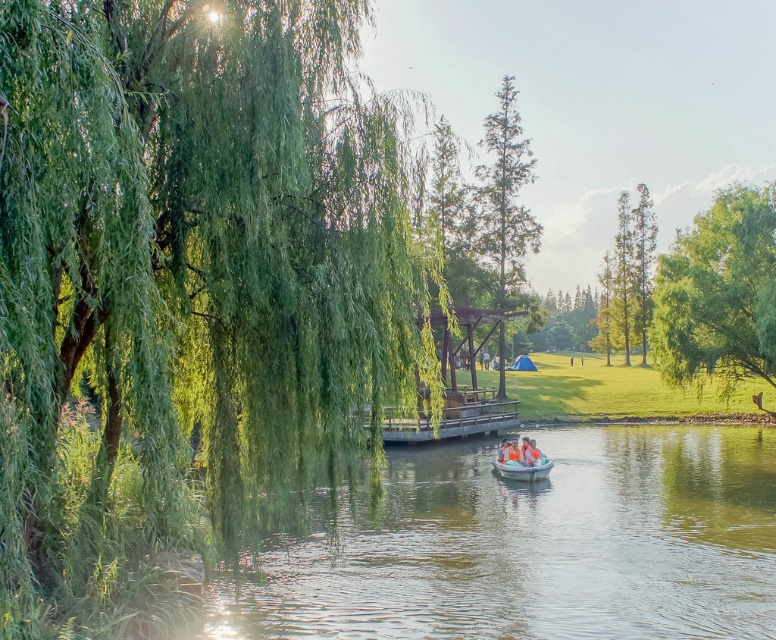
You are standing at the wooden dock in the middle of the scene. Which tree, the green leafy willow at left or the green leafy tree at right, is closer to you?

The green leafy willow at left is closer to you than the green leafy tree at right.

From the picture: You are standing in the park and want to take a photo of the green leafy tree at center and the green smooth tree at upper right. Which tree is closer to the left edge of your camera view?

The green leafy tree at center is positioned on the left side of green smooth tree at upper right, so it will appear closer to the left edge of the camera view.